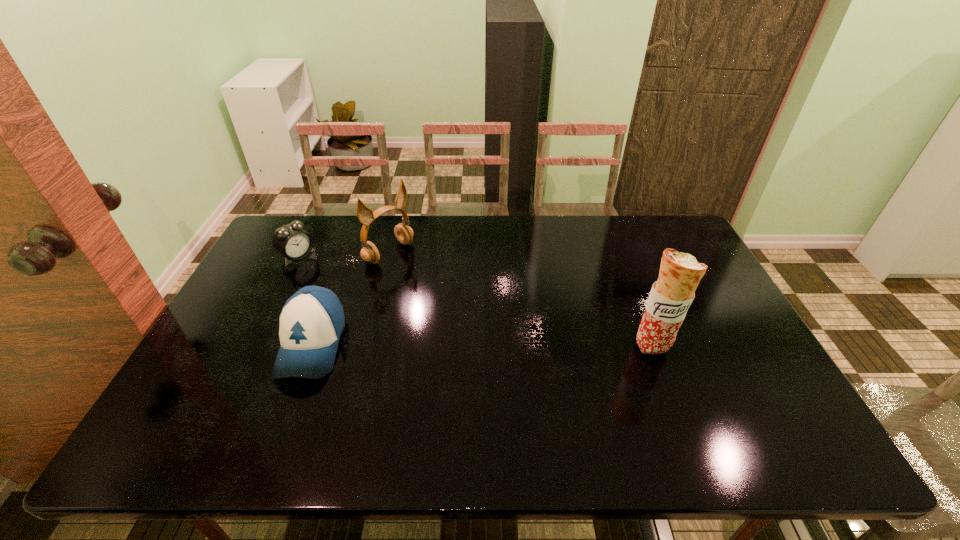
At what (x,y) coordinates should I click in order to perform the action: click on object that is the closest to the baseball cap. Please return your answer as a coordinate pair (x, y). This screenshot has height=540, width=960. Looking at the image, I should click on (369, 252).

Locate an element on the screen. The image size is (960, 540). vacant space that satisfies the following two spatial constraints: 1. on the back side of the earphone; 2. on the right side of the leftmost object is located at coordinates (300, 253).

I want to click on vacant space that satisfies the following two spatial constraints: 1. on the front-facing side of the tallest object; 2. on the left side of the baseball cap, so click(312, 346).

Find the location of a particular element. This screenshot has width=960, height=540. blank space that satisfies the following two spatial constraints: 1. on the front side of the earphone; 2. on the left side of the tallest object is located at coordinates (366, 346).